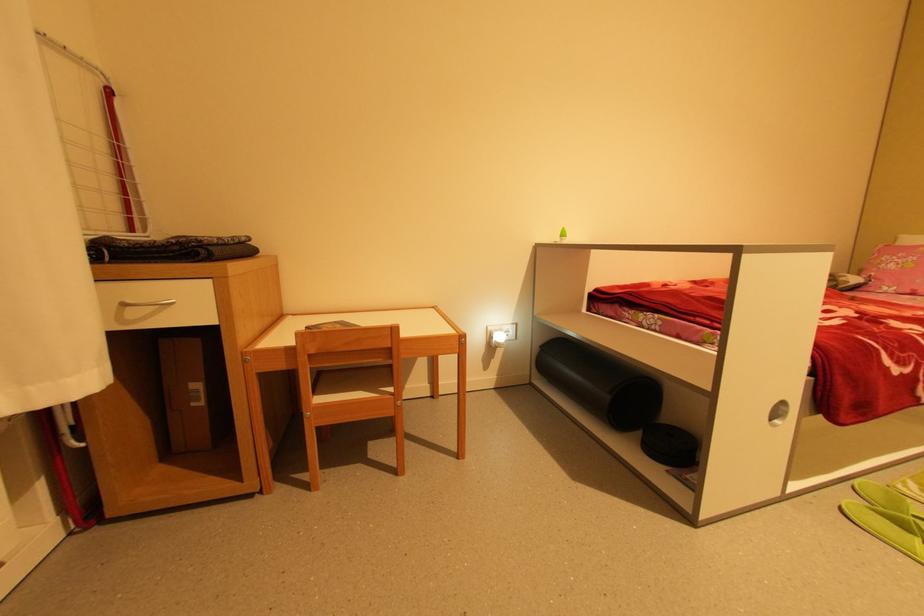
Find where to wear the green slipper. Please return your answer as a coordinate pair (x, y).

(888, 527)